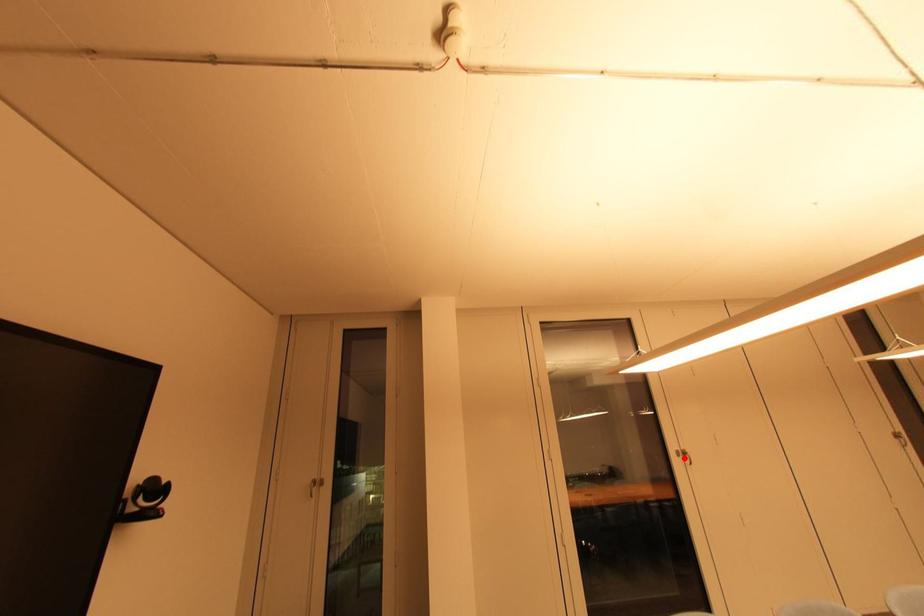
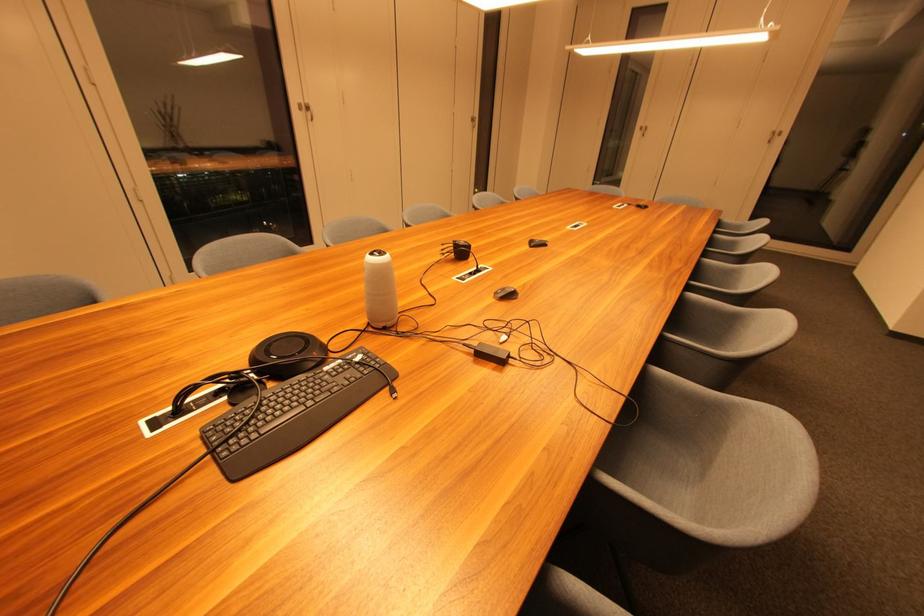
Question: I am providing you with two images of the same scene from different viewpoints. Image1 has a red point marked. In image2, the corresponding 3D location appears at what relative position? Reply with the corresponding letter.

Choices:
 (A) Closer
 (B) Farther

Answer: (A)